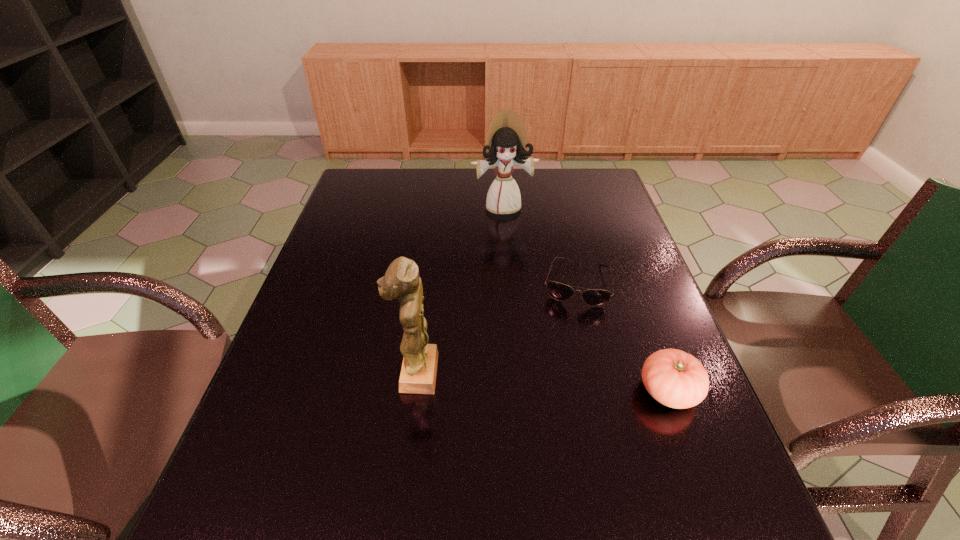
Where is `free spot on the desktop that is between the leftmost object and the third tallest object and is positioned at the front face of the farthest object`? free spot on the desktop that is between the leftmost object and the third tallest object and is positioned at the front face of the farthest object is located at coordinates (547, 382).

At what (x,y) coordinates should I click in order to perform the action: click on free space on the desktop that is between the figurine and the tomato and is positioned on the front-facing side of the sunglasses. Please return your answer as a coordinate pair (x, y). This screenshot has height=540, width=960. Looking at the image, I should click on (560, 383).